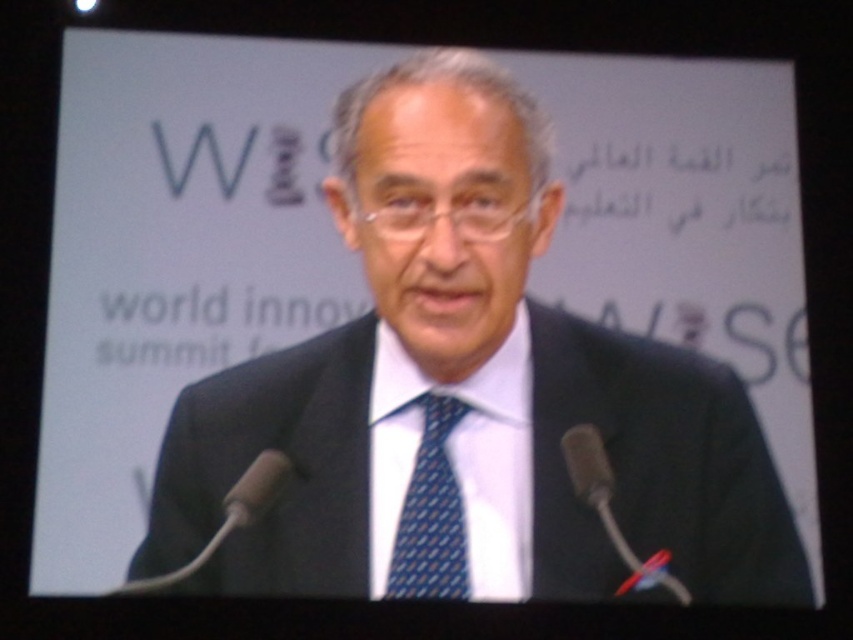
You are standing at the front of the stage facing the audience. There are two points marked on the floor in front of you. The first point is at coordinate point (456, 506) and the second is at coordinate point (259, 480). If you want to walk towards the point that is closer to the audience, which coordinate should you step on?

Point (259, 480) is closer to the audience because it is in front of point (456, 506), which is behind it.

You are organizing a conference and need to place a 1.2 meter wide banner between the black silk suit at center and the metallic silver microphone at center. Can the banner fit between them?

The black silk suit at center has a larger size compared to metallic silver microphone at center, but the distance between them isn not specified in the objects description. Therefore, it is impossible to determine if the banner will fit.

You are a photographer at the World Innovation Summit. You need to capture a photo where the blue dotted tie at center and the black plastic microphone at lower left are both visible. Which object will appear taller in the photo?

The blue dotted tie at center will appear taller in the photo because it is taller than the black plastic microphone at lower left.